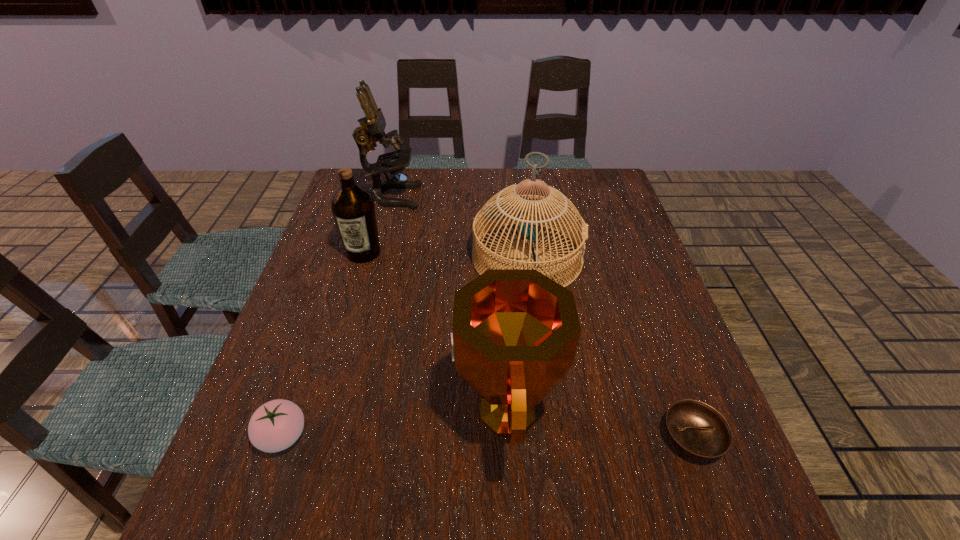
Where is `vacant area that lies between the birdcage and the shortest object`? The height and width of the screenshot is (540, 960). vacant area that lies between the birdcage and the shortest object is located at coordinates (610, 347).

The image size is (960, 540). Identify the location of vacant space that's between the microscope and the birdcage. (459, 227).

Image resolution: width=960 pixels, height=540 pixels. In order to click on free space between the tomato and the award in this screenshot , I will do `click(395, 423)`.

This screenshot has height=540, width=960. Identify the location of vacant space that's between the fifth tallest object and the tallest object. (337, 316).

Image resolution: width=960 pixels, height=540 pixels. What are the coordinates of `vacant area that lies between the olive oil and the birdcage` in the screenshot? It's located at (445, 255).

Identify the location of free space between the birdcage and the tomato. (405, 347).

At what (x,y) coordinates should I click in order to perform the action: click on unoccupied area between the award and the rightmost object. Please return your answer as a coordinate pair (x, y). The height and width of the screenshot is (540, 960). Looking at the image, I should click on (599, 424).

Where is `empty location between the rightmost object and the birdcage`? empty location between the rightmost object and the birdcage is located at coordinates (610, 347).

Find the location of a particular element. The image size is (960, 540). vacant space that is in between the fifth tallest object and the shortest object is located at coordinates (488, 437).

I want to click on object that is the fourth closest to the tallest object, so click(276, 425).